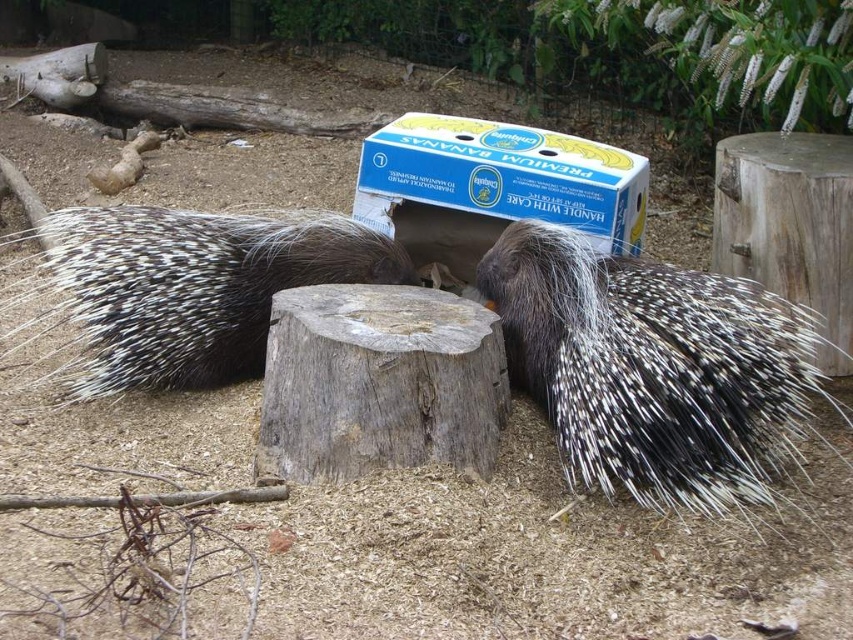
From the picture: You are observing two points in the zoo enclosure. The first point is at coordinates point (805, 371) and the second is at point (16, 328). Which point is closer to your viewpoint?

Point (805, 371) is closer to the camera than point (16, 328).

What is located at the coordinates point (193, 288) in the image?

The point (193, 288) indicates a spiny brown hedgehog at center.

You are a zookeeper who needs to place a new feeding tray between the spiny black hedgehog at center and the blue cardboard box at center. The tray is 24 inches long. Will it fit between them?

The distance between the spiny black hedgehog at center and the blue cardboard box at center is 23.36 inches. Since the feeding tray is 24 inches long, it will not fit between them as it is slightly longer than the available space.